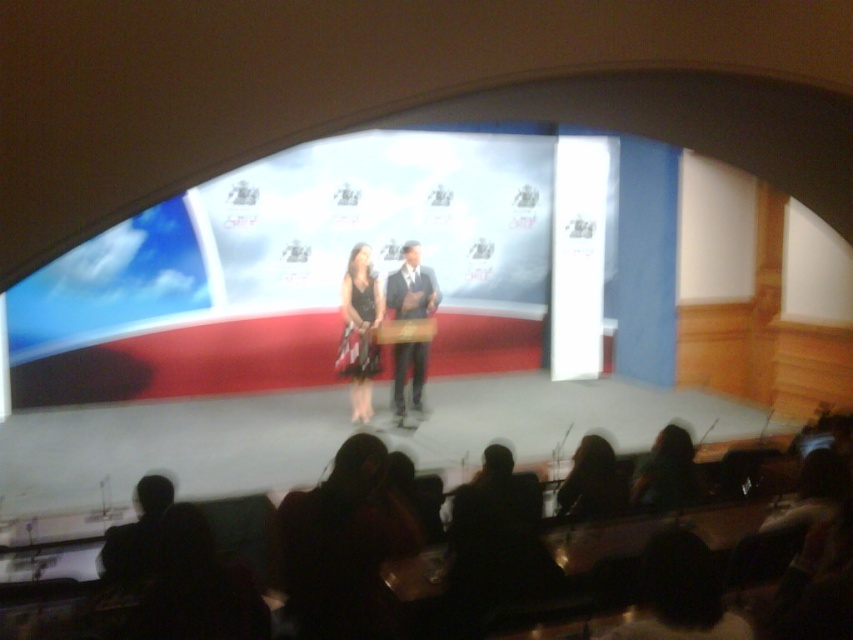
Is black satin dress at center wider than dark suit at center?

Incorrect, black satin dress at center's width does not surpass dark suit at center's.

What are the coordinates of `black satin dress at center` in the screenshot? It's located at (358, 330).

Can you confirm if white glossy projection screen at center is wider than silky brown hair at lower center?

Correct, the width of white glossy projection screen at center exceeds that of silky brown hair at lower center.

Between point (339, 320) and point (593, 451), which one is positioned behind?

Point (339, 320)

Locate an element on the screen. The image size is (853, 640). white glossy projection screen at center is located at coordinates (292, 272).

Does dark suit at center appear on the left side of green matte dress at lower right?

Correct, you'll find dark suit at center to the left of green matte dress at lower right.

Is point (419, 250) in front of point (683, 433)?

No, it is behind (683, 433).

Who is more forward, (393, 403) or (660, 509)?

Point (660, 509) is in front.

Find the location of a particular element. dark suit at center is located at coordinates (410, 285).